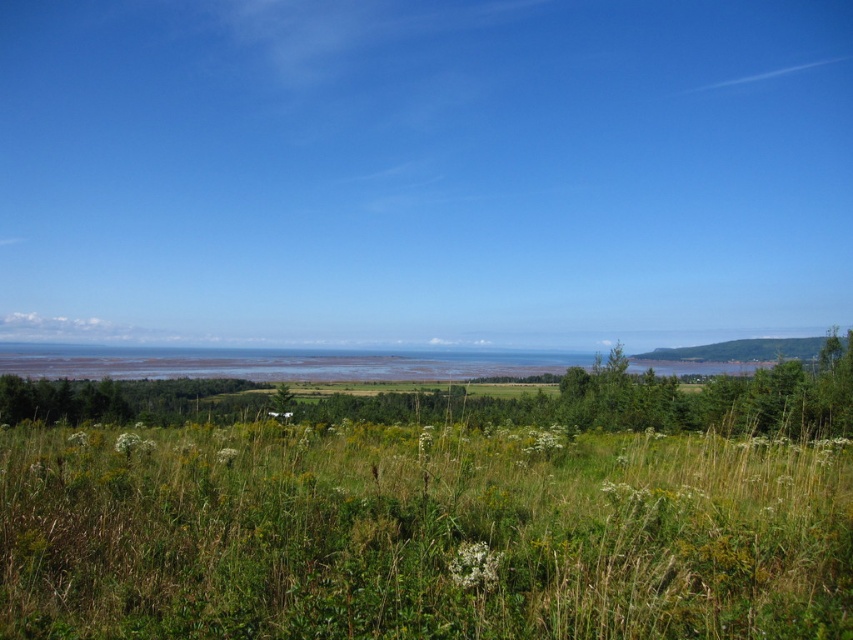
Question: Can you confirm if green grassy field at center is positioned to the right of green leafy tree at lower center?

Choices:
 (A) yes
 (B) no

Answer: (B)

Question: Which object is farther from the camera taking this photo?

Choices:
 (A) green leafy tree at lower center
 (B) green grassy field at center

Answer: (A)

Question: Considering the relative positions of green grassy field at center and green leafy tree at lower center in the image provided, where is green grassy field at center located with respect to green leafy tree at lower center?

Choices:
 (A) below
 (B) above

Answer: (B)

Question: Which object is farther from the camera taking this photo?

Choices:
 (A) green leafy tree at lower center
 (B) green grassy field at center

Answer: (A)

Question: Can you confirm if green grassy field at center is positioned below green leafy tree at lower center?

Choices:
 (A) yes
 (B) no

Answer: (B)